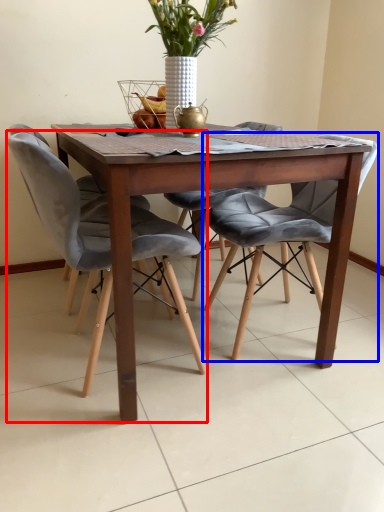
Question: Which of the following is the closest to the observer, chair (highlighted by a red box) or chair (highlighted by a blue box)?

Choices:
 (A) chair
 (B) chair

Answer: (A)